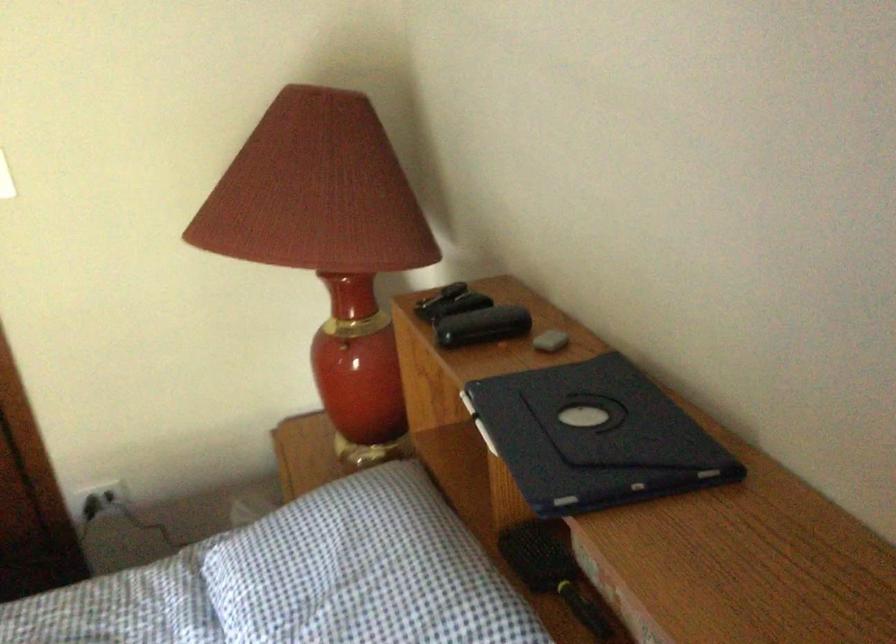
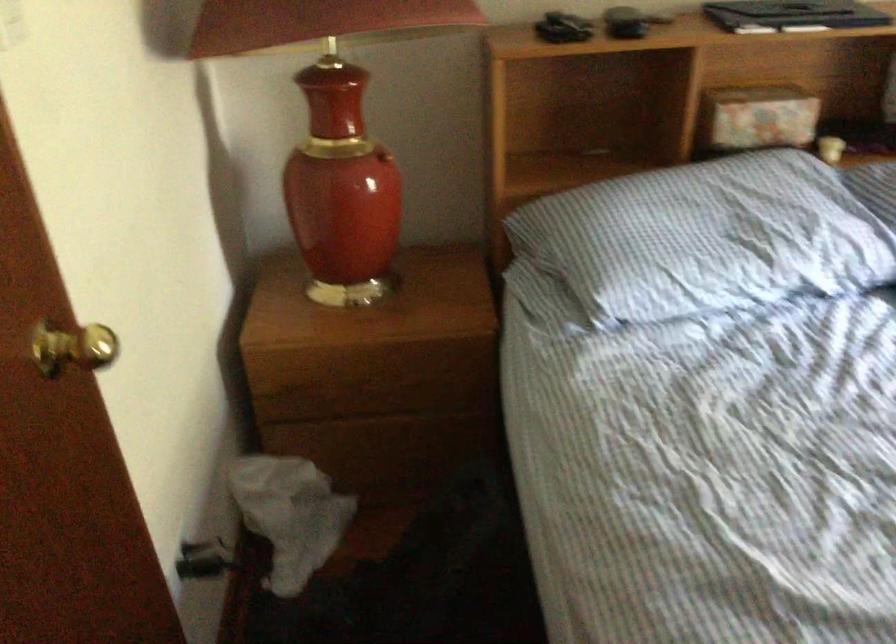
Where in the second image is the point corresponding to (x=306, y=574) from the first image?

(707, 238)